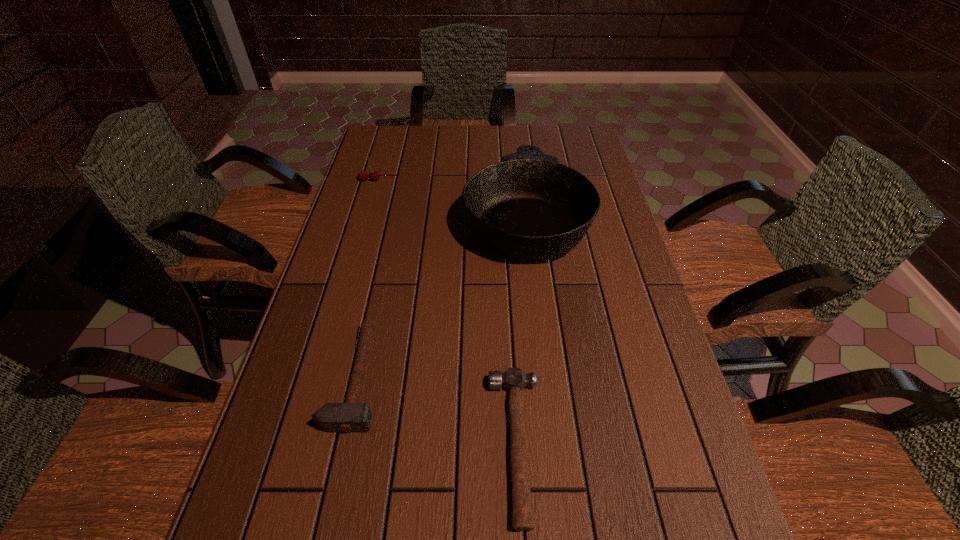
The width and height of the screenshot is (960, 540). I want to click on empty space between the leftmost object and the right hammer, so click(444, 313).

Find the location of a particular element. This screenshot has width=960, height=540. free area in between the shortest object and the leftmost object is located at coordinates (444, 313).

Select which object appears as the second closest to the leftmost object. Please provide its 2D coordinates. Your answer should be formatted as a tuple, i.e. [(x, y)], where the tuple contains the x and y coordinates of a point satisfying the conditions above.

[(350, 417)]

This screenshot has width=960, height=540. What are the coordinates of `object that is the second nearest to the right hammer` in the screenshot? It's located at (529, 206).